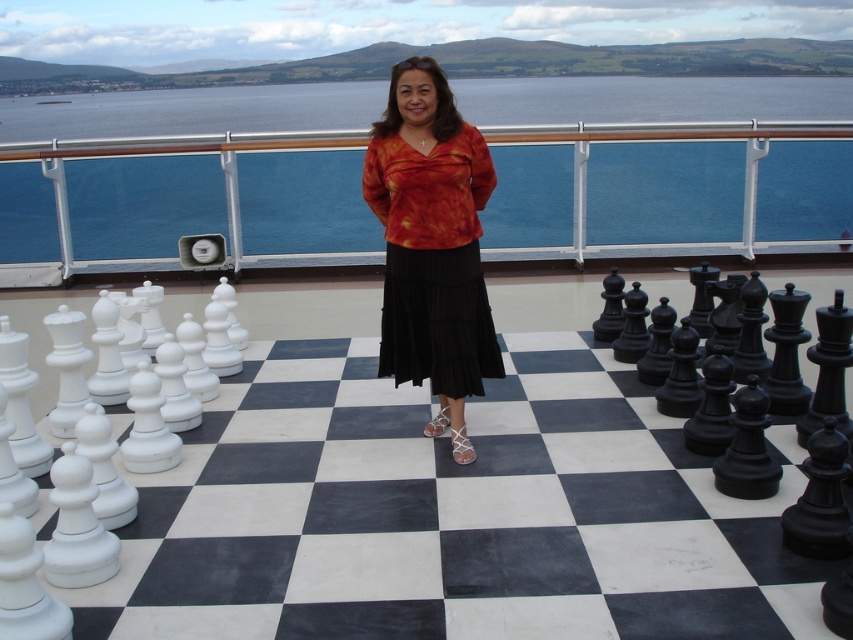
Looking at this image, does white glossy chessboard at center appear under orange tie-dye blouse at center?

Correct, white glossy chessboard at center is located below orange tie-dye blouse at center.

Is white glossy chessboard at center further to the viewer compared to orange tie-dye blouse at center?

No, it is not.

Is point (344, 509) positioned in front of point (395, 253)?

Yes, point (344, 509) is closer to viewer.

Find the location of a particular element. white glossy chessboard at center is located at coordinates (450, 513).

Is point (173, 490) less distant than point (645, 83)?

Yes, point (173, 490) is in front of point (645, 83).

Does white glossy chessboard at center appear under blue water at upper center?

Yes.

Where is `white glossy chessboard at center`? white glossy chessboard at center is located at coordinates (450, 513).

Locate an element on the screen. The image size is (853, 640). white glossy chessboard at center is located at coordinates (450, 513).

Who is higher up, blue water at upper center or orange tie-dye blouse at center?

blue water at upper center

Is blue water at upper center below orange tie-dye blouse at center?

No, blue water at upper center is not below orange tie-dye blouse at center.

Which is behind, point (573, 106) or point (454, 156)?

Point (573, 106)

Identify the location of blue water at upper center. (653, 99).